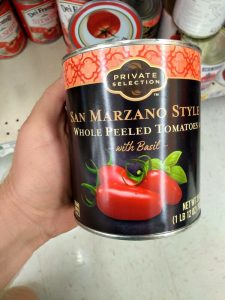
This screenshot has height=300, width=225. Identify the location of shelf. (21, 85).